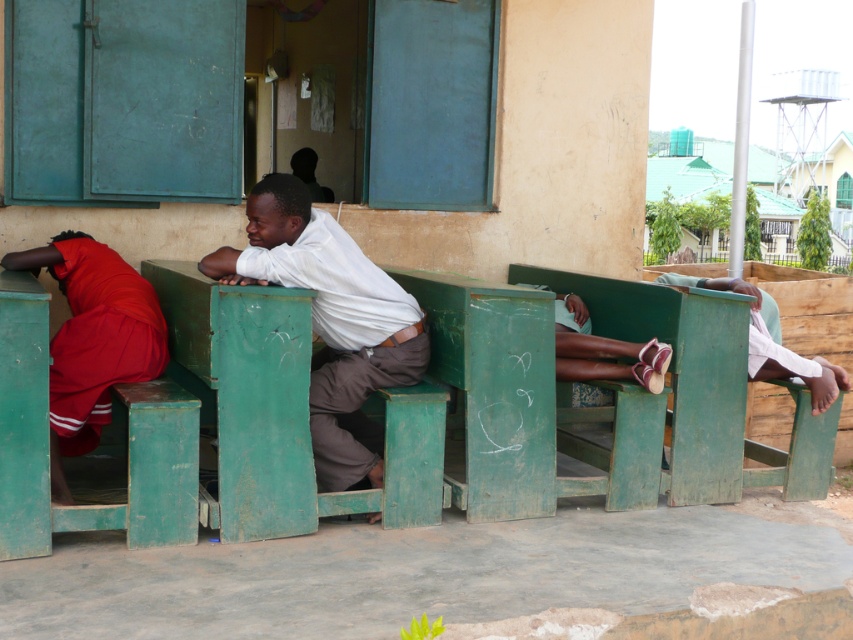
Which of these two, white matte shirt at center or matte white shirt at center, stands taller?

white matte shirt at center

Looking at this image, is white matte shirt at center behind matte white shirt at center?

That is True.

Locate an element on the screen. This screenshot has height=640, width=853. white matte shirt at center is located at coordinates (329, 317).

In order to click on white matte shirt at center in this screenshot , I will do `click(329, 317)`.